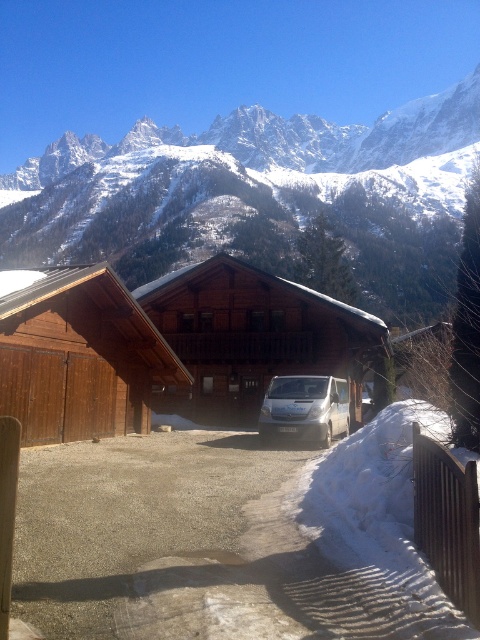
Between wooden cabin at center and brown wooden cabin at left, which one has less height?

brown wooden cabin at left is shorter.

Is point (356, 362) more distant than point (63, 385)?

Yes, point (356, 362) is behind point (63, 385).

Locate an element on the screen. This screenshot has width=480, height=640. wooden cabin at center is located at coordinates (252, 337).

Is brown wooden cabin at left in front of white metallic van at center?

Yes, brown wooden cabin at left is closer to the viewer.

Between brown wooden cabin at left and white metallic van at center, which one has less height?

white metallic van at center is shorter.

Is point (20, 356) more distant than point (327, 419)?

No, (20, 356) is closer to viewer.

What are the coordinates of `brown wooden cabin at left` in the screenshot? It's located at (78, 355).

Does snowy rock at upper center come behind brown wooden cabin at left?

That is True.

Image resolution: width=480 pixels, height=640 pixels. What are the coordinates of `snowy rock at upper center` in the screenshot? It's located at (263, 198).

Measure the distance between point (128,220) and camera.

209.86 meters

At what (x,y) coordinates should I click in order to perform the action: click on snowy rock at upper center. Please return your answer as a coordinate pair (x, y). This screenshot has width=480, height=640. Looking at the image, I should click on (263, 198).